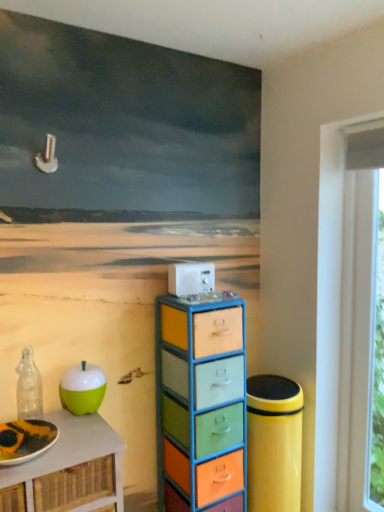
Locate an element on the screen. The height and width of the screenshot is (512, 384). vacant area to the right of matte white plate at lower left is located at coordinates (84, 442).